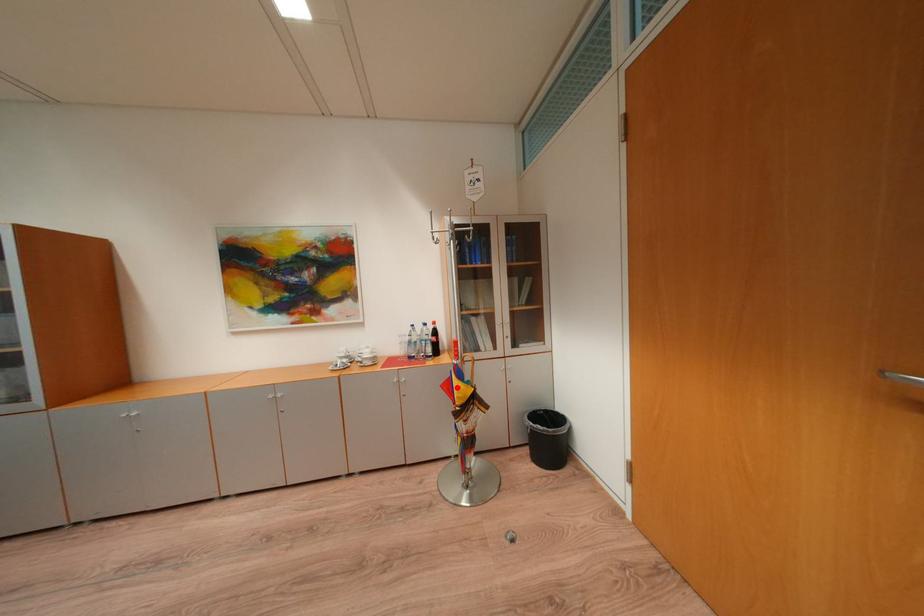
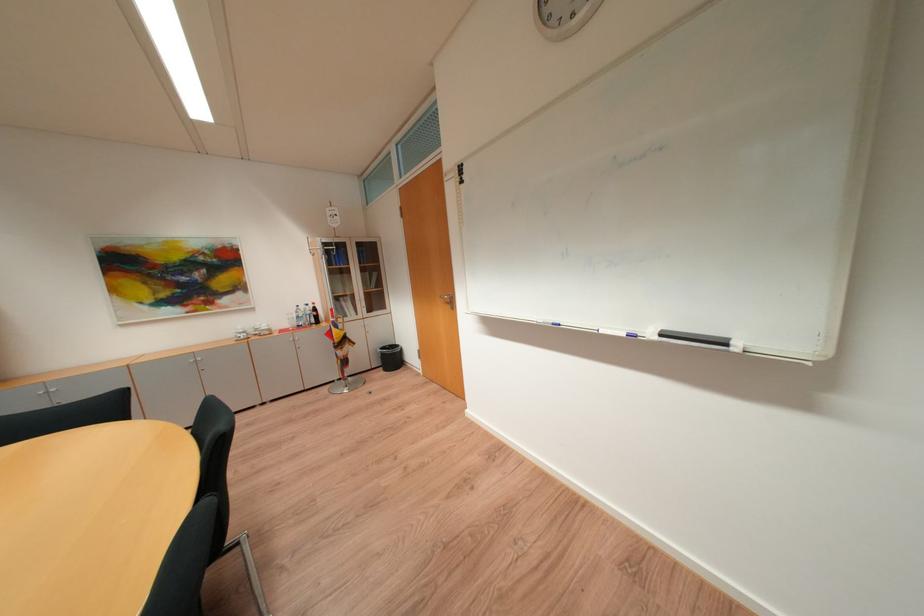
Find the pixel in the second image that matches the highlighted location in the first image.

(338, 334)